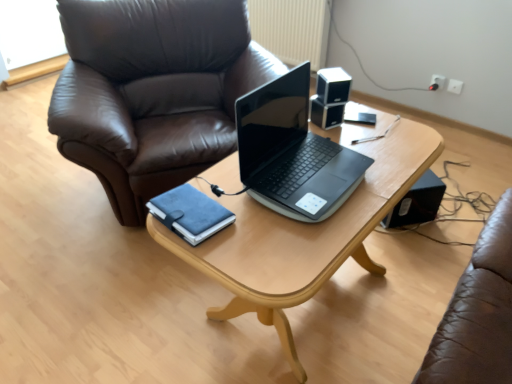
Identify the location of white plastic electric outlet at upper right. This screenshot has height=384, width=512. point(437,82).

This screenshot has width=512, height=384. What are the coordinates of `black plastic speaker at lower right, acting as the 1th speaker starting from the right` in the screenshot? It's located at (417, 202).

What is the approximate height of light wood table at center?

light wood table at center is 63.42 centimeters in height.

You are a GUI agent. You are given a task and a screenshot of the screen. Output one action in this format:
    pyautogui.click(x=<x>, y=<y>)
    Task: Click on the white plastic electric outlet at upper right
    This screenshot has width=512, height=384.
    Given the screenshot: What is the action you would take?
    pyautogui.click(x=437, y=82)

Would you say light wood table at center is part of black glossy speaker at upper right, the 1th speaker viewed from the front,'s contents?

Definitely not — light wood table at center is not inside black glossy speaker at upper right, the 1th speaker viewed from the front.

What's the angular difference between black glossy speaker at upper right, acting as the 2th speaker starting from the right, and light wood table at center's facing directions?

The angle between the facing direction of black glossy speaker at upper right, acting as the 2th speaker starting from the right, and the facing direction of light wood table at center is 57.9 degrees.

How far apart are black glossy speaker at upper right, the second speaker in the left-to-right sequence, and light wood table at center?

black glossy speaker at upper right, the second speaker in the left-to-right sequence, is 18.52 inches from light wood table at center.

Is black glossy speaker at upper right, which is counted as the 3th speaker, starting from the back, at the left side of light wood table at center?

Incorrect, black glossy speaker at upper right, which is counted as the 3th speaker, starting from the back, is not on the left side of light wood table at center.

Considering the sizes of objects sleek black laptop at center and light wood table at center in the image provided, who is shorter, sleek black laptop at center or light wood table at center?

sleek black laptop at center is shorter.

Which object is closer to the camera taking this photo, sleek black laptop at center or light wood table at center?

Positioned in front is light wood table at center.

Is sleek black laptop at center positioned far away from light wood table at center?

No, sleek black laptop at center is in close proximity to light wood table at center.

Considering the positions of objects sleek black laptop at center and light wood table at center in the image provided, who is more to the left, sleek black laptop at center or light wood table at center?

sleek black laptop at center.

From a real-world perspective, does black plastic speaker at lower right, which is the 1th speaker from bottom to top, stand above sleek black laptop at center?

Incorrect, from a real-world perspective, black plastic speaker at lower right, which is the 1th speaker from bottom to top, is lower than sleek black laptop at center.

Which is more to the right, black plastic speaker at lower right, which is the 3th speaker from top to bottom, or sleek black laptop at center?

Positioned to the right is black plastic speaker at lower right, which is the 3th speaker from top to bottom.

From the image's perspective, is black plastic speaker at lower right, acting as the 1th speaker starting from the right, above or below sleek black laptop at center?

From the image's perspective, black plastic speaker at lower right, acting as the 1th speaker starting from the right, appears below sleek black laptop at center.

Based on their sizes in the image, would you say black plastic speaker at lower right, the 1th speaker when ordered from back to front, is bigger or smaller than sleek black laptop at center?

black plastic speaker at lower right, the 1th speaker when ordered from back to front, is smaller than sleek black laptop at center.

Is light wood table at center thinner than white plastic electric outlet at upper right?

No.

From the picture: Is light wood table at center directly adjacent to white plastic electric outlet at upper right?

No, light wood table at center is not next to white plastic electric outlet at upper right.

How many degrees apart are the facing directions of light wood table at center and white plastic electric outlet at upper right?

The facing directions of light wood table at center and white plastic electric outlet at upper right are 85 degrees apart.

Considering the positions of points (404, 140) and (433, 77), is point (404, 140) farther from camera compared to point (433, 77)?

No.

Find the location of a particular element. The height and width of the screenshot is (384, 512). laptop that is on the left side of black plastic speaker at upper center, arranged as the 2th speaker when viewed from the top is located at coordinates (292, 152).

Is there a large distance between sleek black laptop at center and black plastic speaker at upper center, which ranks as the 2th speaker in bottom-to-top order?

sleek black laptop at center is actually quite close to black plastic speaker at upper center, which ranks as the 2th speaker in bottom-to-top order.

Which object is further away from the camera taking this photo, sleek black laptop at center or black plastic speaker at upper center, which ranks as the 2th speaker in bottom-to-top order?

Positioned behind is black plastic speaker at upper center, which ranks as the 2th speaker in bottom-to-top order.

Which of these two, sleek black laptop at center or black plastic speaker at upper center, which ranks as the 2th speaker in bottom-to-top order, is smaller?

With smaller size is black plastic speaker at upper center, which ranks as the 2th speaker in bottom-to-top order.

Which object is positioned more to the left, suede blue notebook at center or sleek black laptop at center?

Positioned to the left is suede blue notebook at center.

Looking at this image, is suede blue notebook at center located outside sleek black laptop at center?

Absolutely, suede blue notebook at center is external to sleek black laptop at center.

From a real-world perspective, does suede blue notebook at center stand above sleek black laptop at center?

No, from a real-world perspective, suede blue notebook at center is not above sleek black laptop at center.

What's the angular difference between black plastic speaker at lower right, acting as the 1th speaker starting from the right, and black plastic speaker at upper center, the second speaker viewed from the back,'s facing directions?

They differ by 20.1 degrees in their facing directions.

Based on the photo, which is closer, (x=408, y=197) or (x=328, y=126)?

Point (x=408, y=197).

Considering the positions of objects black plastic speaker at lower right, the 1th speaker when ordered from back to front, and black plastic speaker at upper center, which appears as the 2th speaker when viewed from the front, in the image provided, who is more to the left, black plastic speaker at lower right, the 1th speaker when ordered from back to front, or black plastic speaker at upper center, which appears as the 2th speaker when viewed from the front,?

black plastic speaker at upper center, which appears as the 2th speaker when viewed from the front.

Consider the image. Could you measure the distance between black plastic speaker at lower right, acting as the 1th speaker starting from the right, and black plastic speaker at upper center, which appears as the 2th speaker when viewed from the front?

The distance of black plastic speaker at lower right, acting as the 1th speaker starting from the right, from black plastic speaker at upper center, which appears as the 2th speaker when viewed from the front, is 29.63 inches.

Identify the location of the 3rd speaker above the light wood table at center (from the image's perspective). (333, 85).

The image size is (512, 384). Find the location of `table that appears below the sleek black laptop at center (from a real-world perspective)`. table that appears below the sleek black laptop at center (from a real-world perspective) is located at coordinates (304, 237).

Consider the image. Considering their positions, is light wood table at center positioned further to white plastic electric outlet at upper right than black plastic speaker at upper center, arranged as the 2th speaker when viewed from the top?

light wood table at center.

Considering their positions, is black plastic speaker at lower right, the 1th speaker when ordered from back to front, positioned further to black plastic speaker at upper center, which appears as the 2th speaker when viewed from the front, than sleek black laptop at center?

Based on the image, black plastic speaker at lower right, the 1th speaker when ordered from back to front, appears to be further to black plastic speaker at upper center, which appears as the 2th speaker when viewed from the front.

Considering their positions, is sleek black laptop at center positioned closer to black plastic speaker at upper center, the 3th speaker in the right-to-left sequence, than light wood table at center?

The object closer to black plastic speaker at upper center, the 3th speaker in the right-to-left sequence, is sleek black laptop at center.

From the picture: Based on their spatial positions, is suede blue notebook at center or black plastic speaker at upper center, the second speaker viewed from the back, further from white plastic electric outlet at upper right?

suede blue notebook at center.

Looking at the image, which one is located further to black plastic speaker at lower right, acting as the 1th speaker starting from the right, black glossy speaker at upper right, the 1th speaker viewed from the front, or black plastic speaker at upper center, which appears as the 2th speaker when viewed from the front?

The object further to black plastic speaker at lower right, acting as the 1th speaker starting from the right, is black glossy speaker at upper right, the 1th speaker viewed from the front.

Looking at this image, based on their spatial positions, is suede blue notebook at center or black glossy speaker at upper right, the 1th speaker viewed from the front, further from black plastic speaker at lower right, acting as the 3th speaker starting from the front?

Among the two, suede blue notebook at center is located further to black plastic speaker at lower right, acting as the 3th speaker starting from the front.

Based on their spatial positions, is sleek black laptop at center or black glossy speaker at upper right, the 1th speaker viewed from the front, closer to black plastic speaker at lower right, which is the 3th speaker from top to bottom?

black glossy speaker at upper right, the 1th speaker viewed from the front, is closer to black plastic speaker at lower right, which is the 3th speaker from top to bottom.

Which object lies further to the anchor point white plastic electric outlet at upper right, suede blue notebook at center or black plastic speaker at lower right, placed as the third speaker when sorted from left to right?

Among the two, suede blue notebook at center is located further to white plastic electric outlet at upper right.

Locate an element on the screen. notebook located between sleek black laptop at center and black plastic speaker at lower right, acting as the 1th speaker starting from the right, in the depth direction is located at coordinates (190, 213).

In order to click on speaker located between black plastic speaker at upper center, arranged as the 2th speaker when viewed from the top, and white plastic electric outlet at upper right in the depth direction in this screenshot , I will do `click(417, 202)`.

Locate an element on the screen. Image resolution: width=512 pixels, height=384 pixels. notebook between light wood table at center and black plastic speaker at lower right, which is the 3th speaker from top to bottom, along the z-axis is located at coordinates (190, 213).

Where is `speaker between black plastic speaker at upper center, which appears as the 2th speaker when viewed from the front, and black plastic speaker at lower right, which is the 3th speaker from top to bottom, from left to right`? The height and width of the screenshot is (384, 512). speaker between black plastic speaker at upper center, which appears as the 2th speaker when viewed from the front, and black plastic speaker at lower right, which is the 3th speaker from top to bottom, from left to right is located at coordinates (333, 85).